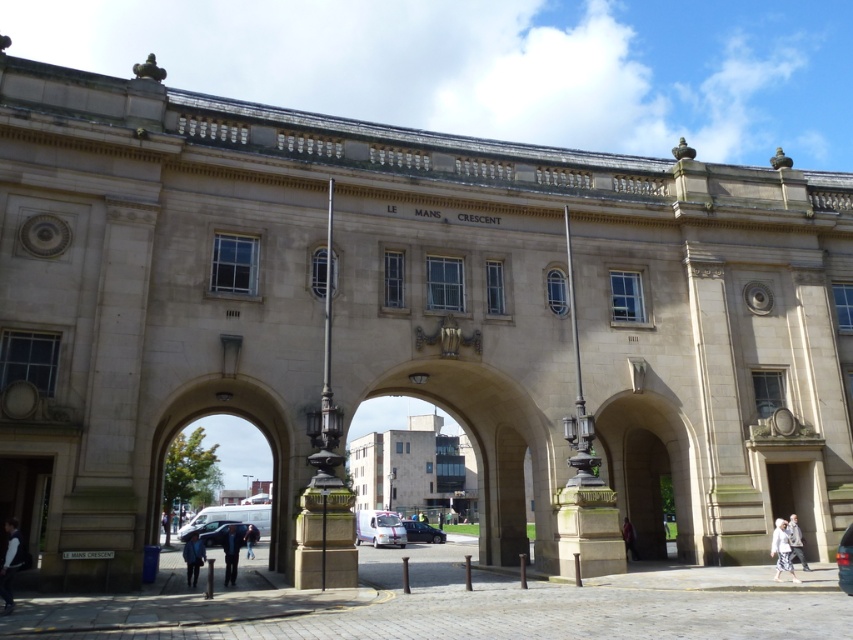
Between point (386, 460) and point (187, 540), which one is positioned in front?

Positioned in front is point (187, 540).

Does white concrete building at center have a greater width compared to dark blue fabric jacket at lower left?

Yes, white concrete building at center is wider than dark blue fabric jacket at lower left.

Find the location of a particular element. white concrete building at center is located at coordinates (415, 470).

The height and width of the screenshot is (640, 853). What are the coordinates of `white concrete building at center` in the screenshot? It's located at (415, 470).

Between dark gray jacket at lower left and white cotton shirt at lower right, which one is positioned higher?

dark gray jacket at lower left is higher up.

Between point (3, 589) and point (785, 563), which one is positioned behind?

Point (785, 563)

Find the location of a particular element. Image resolution: width=853 pixels, height=640 pixels. dark gray jacket at lower left is located at coordinates (10, 563).

Locate an element on the screen. Image resolution: width=853 pixels, height=640 pixels. white concrete building at center is located at coordinates (415, 470).

Does white concrete building at center appear on the left side of dark blue suit at center?

In fact, white concrete building at center is to the right of dark blue suit at center.

Is point (374, 504) positioned after point (231, 545)?

Yes, point (374, 504) is farther from viewer.

Where is `white concrete building at center`? Image resolution: width=853 pixels, height=640 pixels. white concrete building at center is located at coordinates (415, 470).